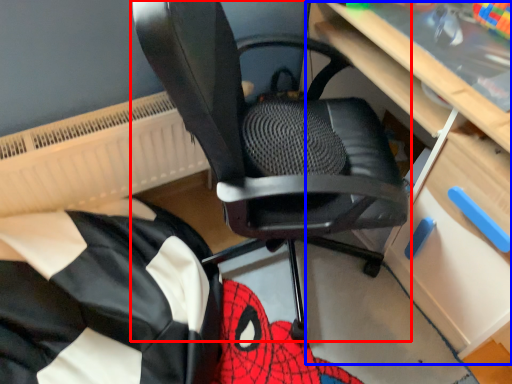
Question: Which object is further to the camera taking this photo, chair (highlighted by a red box) or computer desk (highlighted by a blue box)?

Choices:
 (A) chair
 (B) computer desk

Answer: (B)